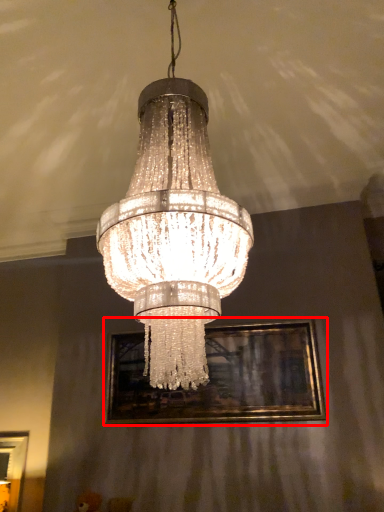
Question: Considering the relative positions of picture frame (annotated by the red box) and lamp in the image provided, where is picture frame (annotated by the red box) located with respect to the staircase?

Choices:
 (A) right
 (B) left

Answer: (A)